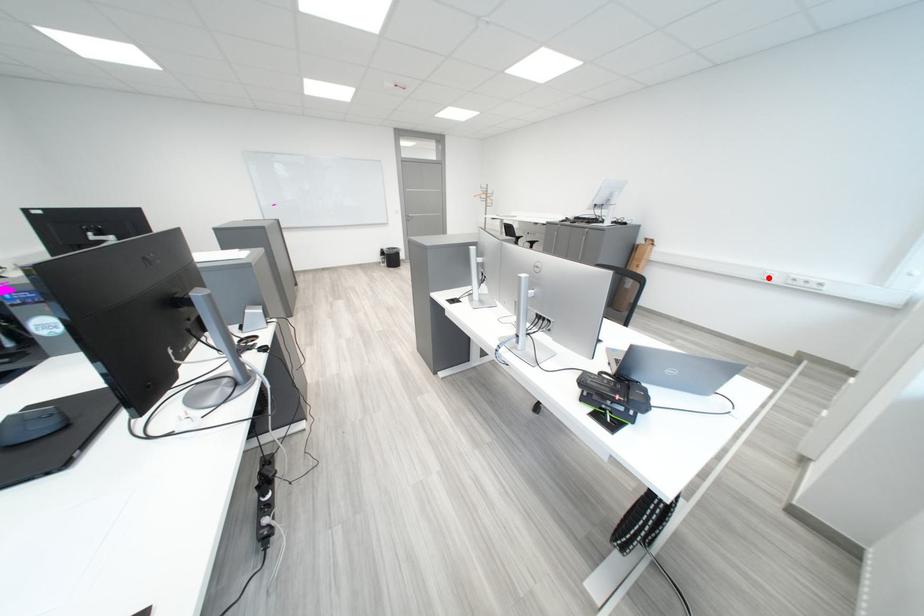
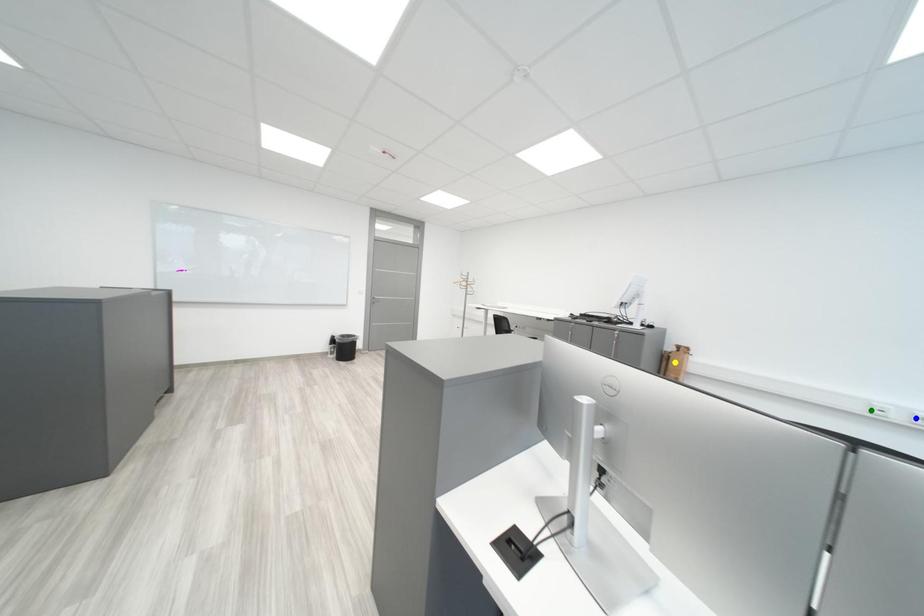
Question: I am providing you with two images of the same scene from different viewpoints. A red point is marked on the first image. You are given multiple points on the second image. Can you choose the point in image 2 that corresponds to the point in image 1?

Choices:
 (A) yellow point
 (B) blue point
 (C) green point

Answer: (C)